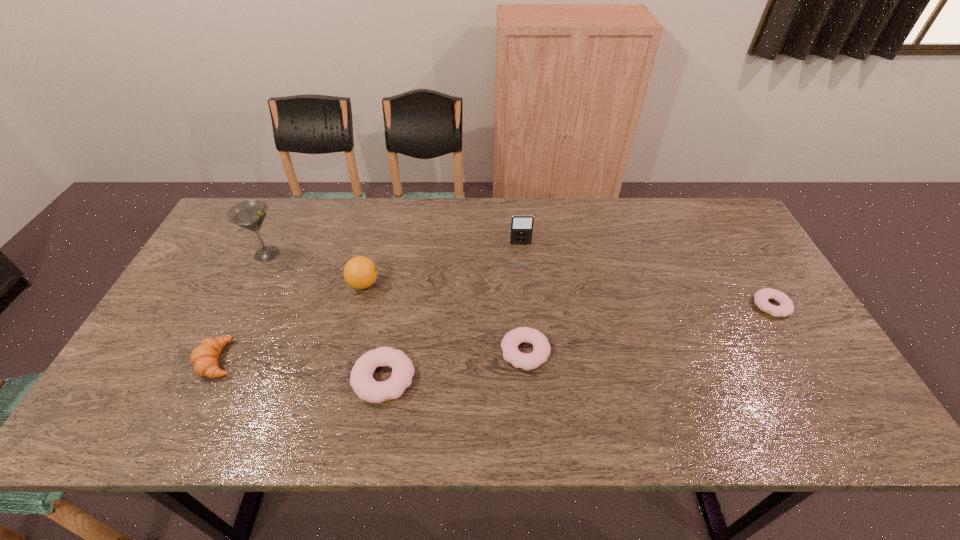
I want to click on vacant space that's between the rightmost object and the third shortest object, so click(578, 342).

Where is `free space between the third tallest object and the sixth shortest object`? free space between the third tallest object and the sixth shortest object is located at coordinates (443, 264).

The image size is (960, 540). What are the coordinates of `vacant point located between the martini and the ping-pong ball` in the screenshot? It's located at (316, 269).

The image size is (960, 540). Identify the location of free space between the ping-pong ball and the crescent roll. (291, 322).

This screenshot has width=960, height=540. What are the coordinates of `vacant region between the tallest object and the tallest doughnut` in the screenshot? It's located at point(325,316).

Find the location of `free spot between the third tallest object and the second doughnut from right to left`. free spot between the third tallest object and the second doughnut from right to left is located at coordinates (444, 318).

Find the location of `free space between the second shortest doughnut and the iPod`. free space between the second shortest doughnut and the iPod is located at coordinates (523, 298).

I want to click on vacant region between the sixth shortest object and the fourth shortest object, so click(x=370, y=302).

Where is `free space between the fifth shortest object and the tallest object`? This screenshot has height=540, width=960. free space between the fifth shortest object and the tallest object is located at coordinates (316, 269).

Locate an element on the screen. Image resolution: width=960 pixels, height=540 pixels. object that is the fourth nearest to the tallest object is located at coordinates (521, 225).